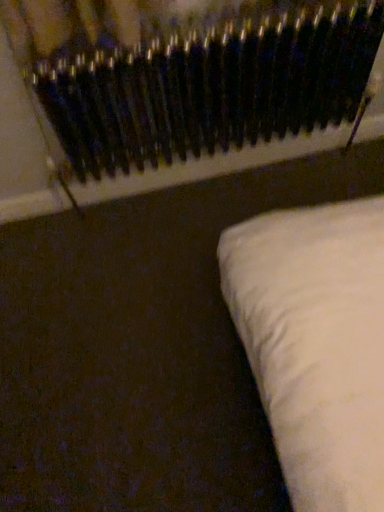
Describe the element at coordinates (177, 92) in the screenshot. I see `black plastic brush at upper center` at that location.

Where is `black plastic brush at upper center`? This screenshot has height=512, width=384. black plastic brush at upper center is located at coordinates (177, 92).

Where is `black plastic brush at upper center`? The width and height of the screenshot is (384, 512). black plastic brush at upper center is located at coordinates (177, 92).